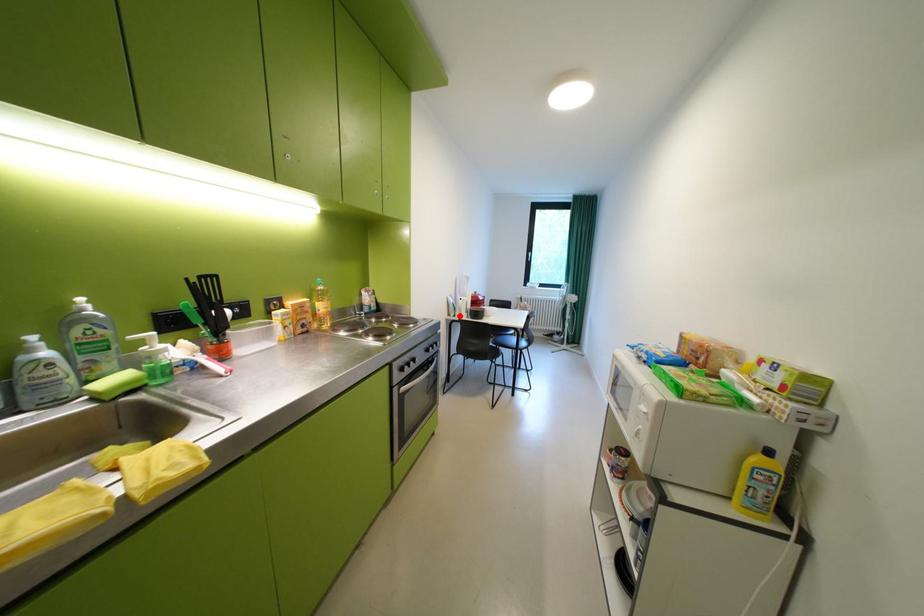
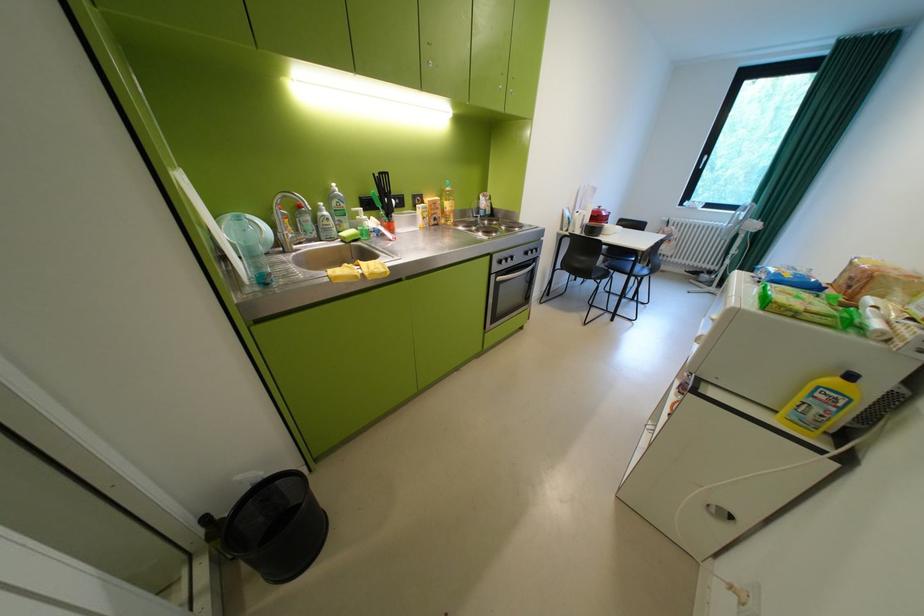
Question: I am providing you with two images of the same scene from different viewpoints. A red point is marked on the first image. Is the red point's position out of view in image 2?

Choices:
 (A) Yes
 (B) No

Answer: (B)